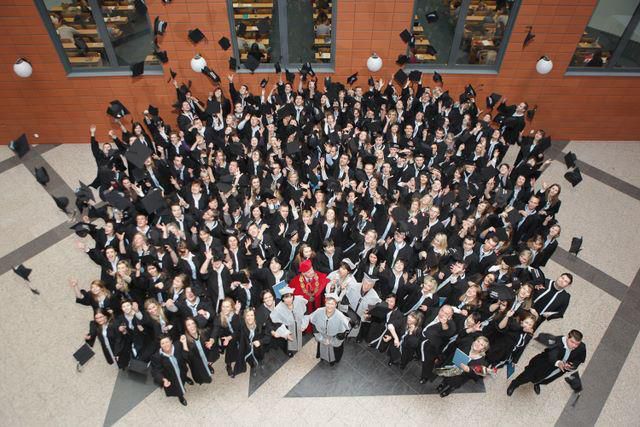
Find the location of a particular element. This screenshot has width=640, height=427. window is located at coordinates (86, 33), (116, 26), (255, 18), (296, 20), (444, 23), (493, 22), (602, 31), (630, 46).